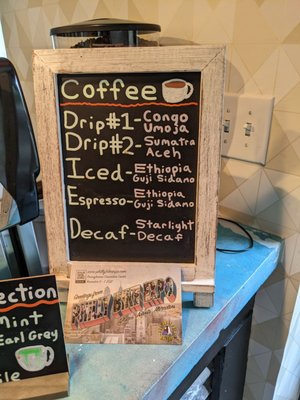
Where is `wooden stand`? wooden stand is located at coordinates (206, 273).